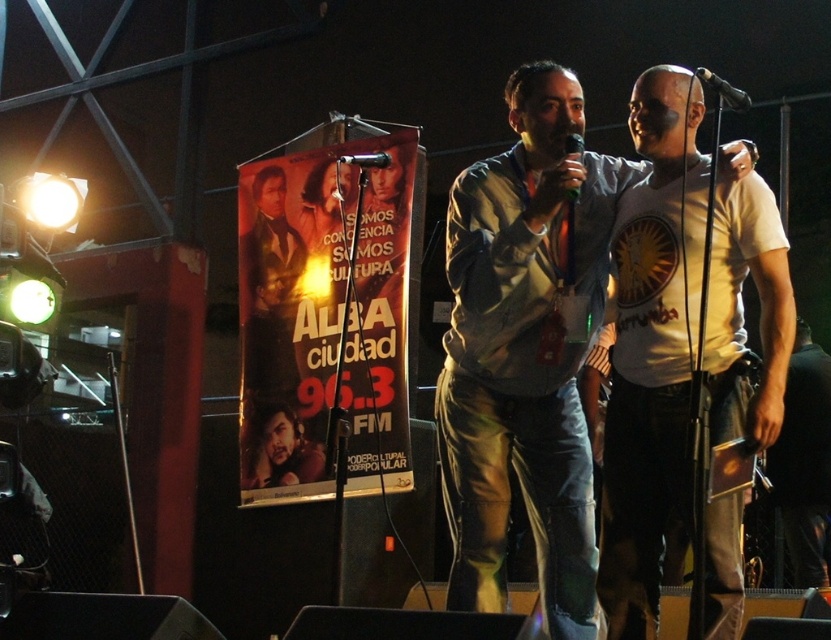
You are a stagehand at the live music event. You need to adjust the microphone stand so that the microphone is positioned exactly at point [723,90]. Can you confirm if the black metallic microphone at upper right is already at that location?

Yes, the black metallic microphone at upper right is already positioned at point [723,90].

You are a photographer at the live music event. You want to take a photo that includes both the camouflage jacket at center and the black metallic microphone at upper right. The minimum distance between the two objects in the photo should be 3 feet. Can you capture both objects in the same frame?

The camouflage jacket at center and the black metallic microphone at upper right are 3.40 feet apart from each other, so yes, the photographer can capture both objects in the same frame since the distance between them is more than the required 3 feet.